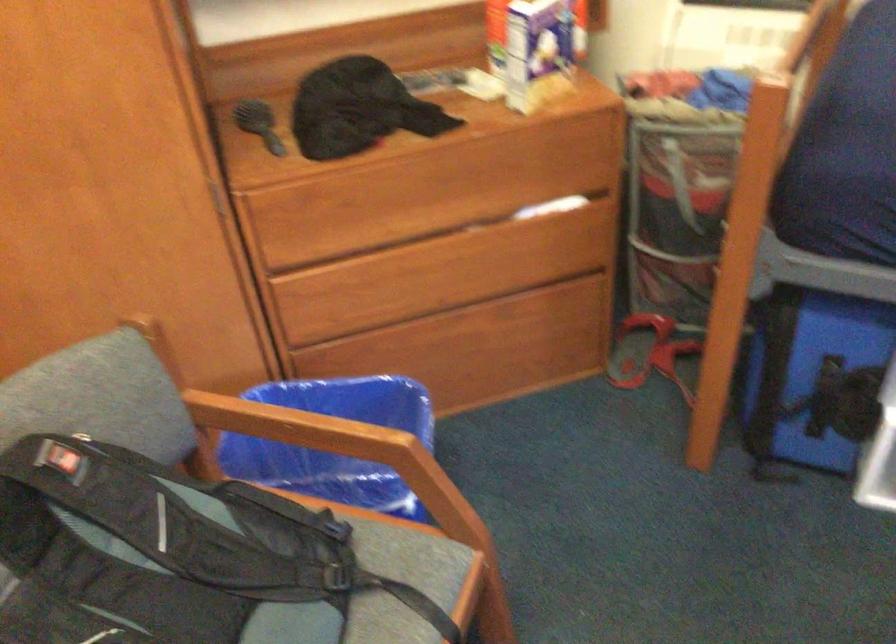
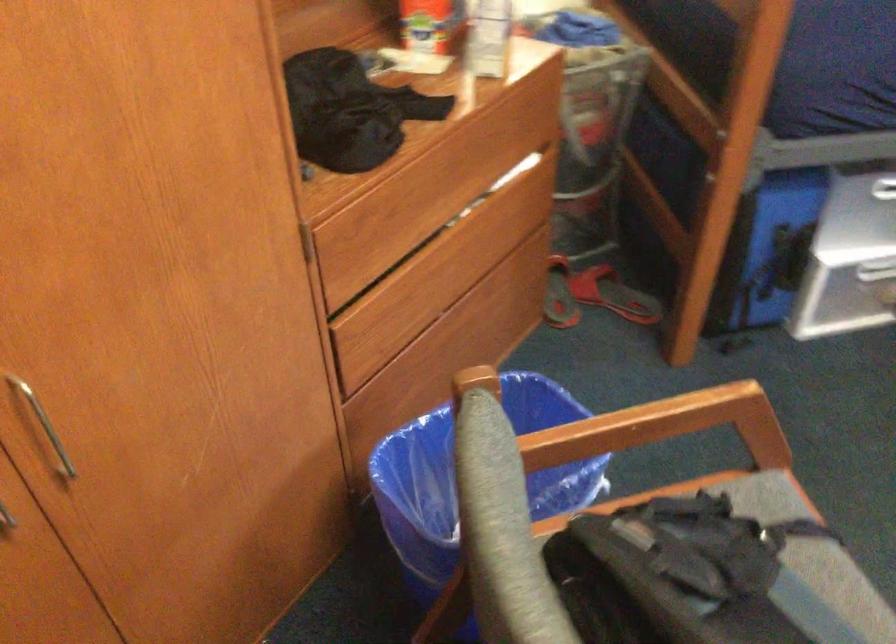
Question: I am providing you with two images of the same scene from different viewpoints. Which of the following objects are not visible in image2?

Choices:
 (A) blue trash can
 (B) metal cabinet handle
 (C) wooden chair armrest
 (D) none of these

Answer: (D)